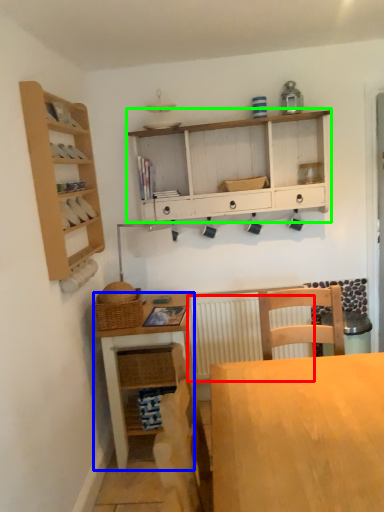
Question: Estimate the real-world distances between objects in this image. Which object is closer to radiator (highlighted by a red box), table (highlighted by a blue box) or cabinetry (highlighted by a green box)?

Choices:
 (A) table
 (B) cabinetry

Answer: (A)